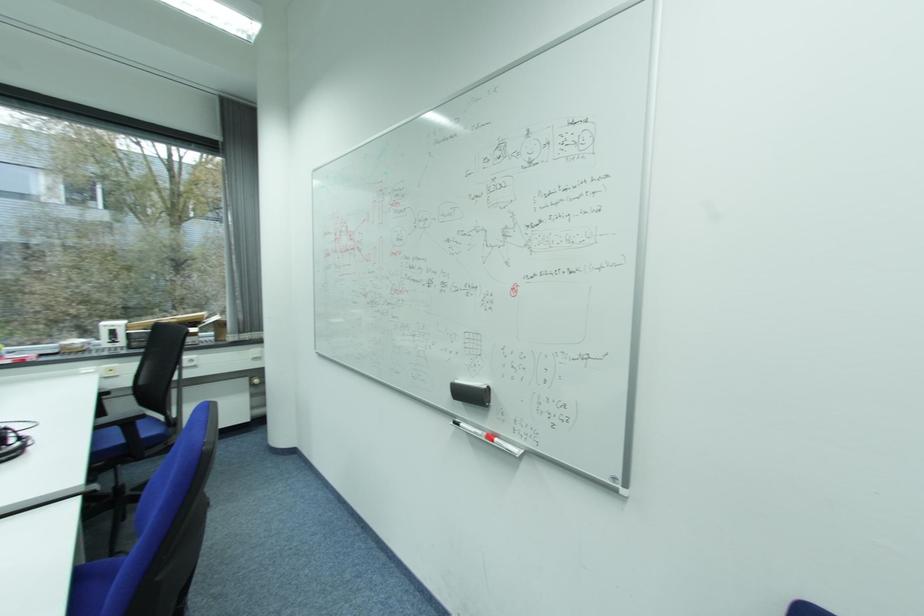
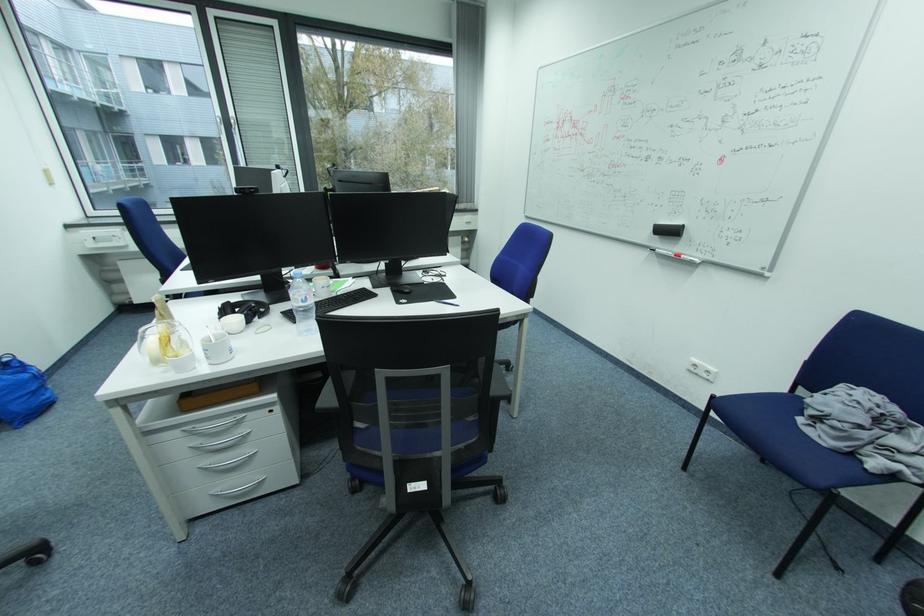
Question: I am providing you with two images of the same scene from different viewpoints. Which of the following objects are not visible in image2?

Choices:
 (A) blue tote bag
 (B) black headphones
 (C) white mug handle
 (D) blue plastic stool

Answer: (B)